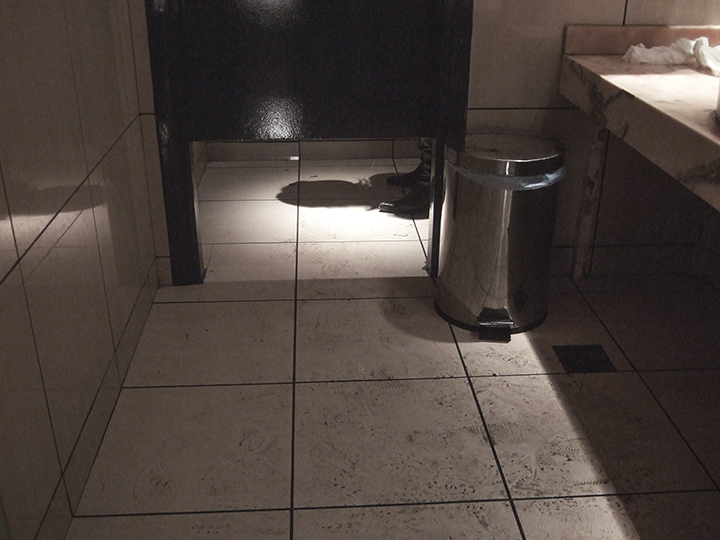
What are the coordinates of `trash can` in the screenshot? It's located at (490, 228).